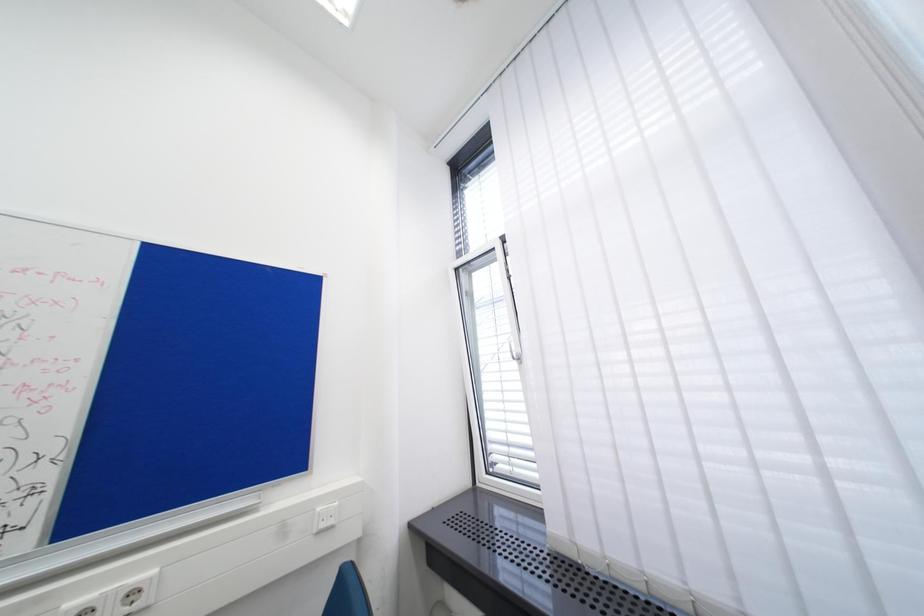
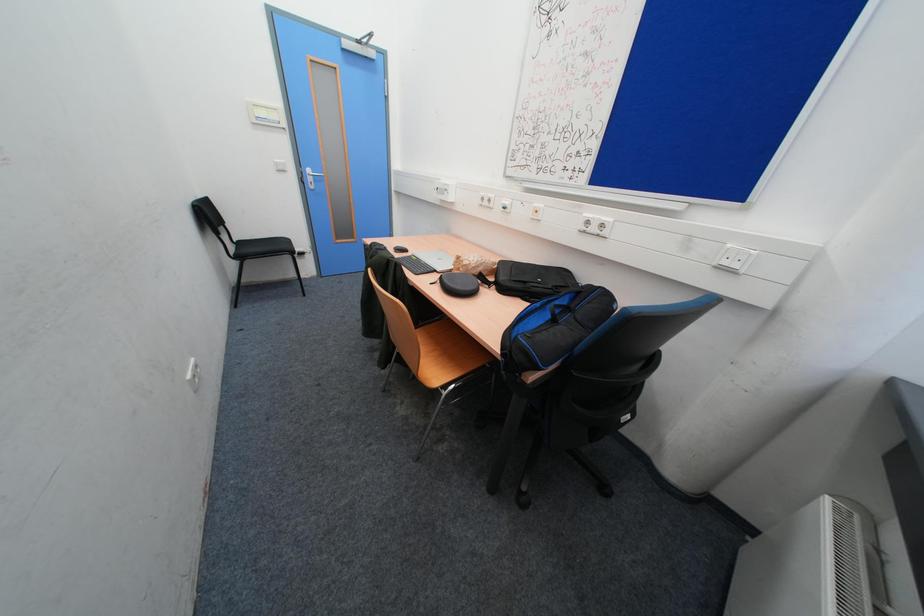
The first image is from the beginning of the video and the second image is from the end. How did the camera likely rotate when shooting the video?

The camera rotated toward left-down.